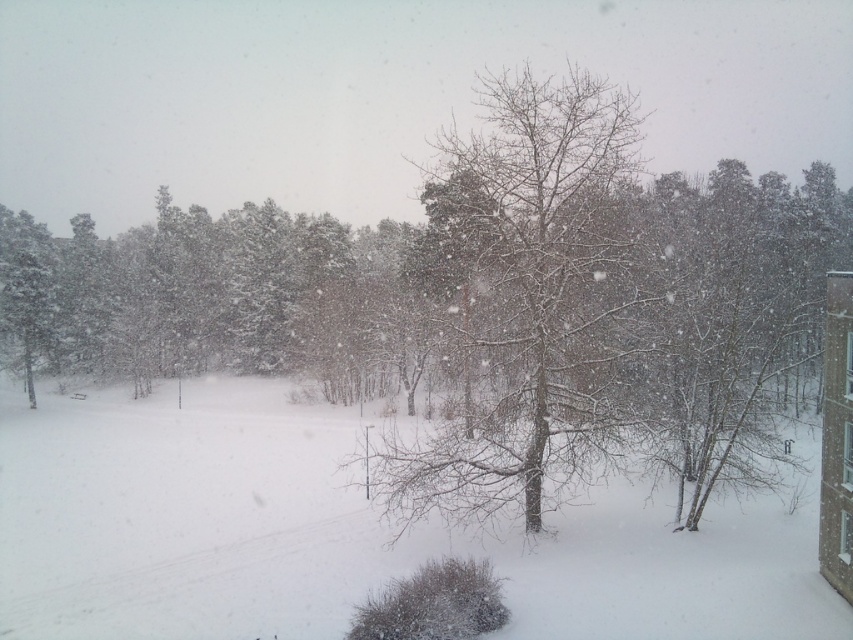
Question: Can you confirm if white fluffy snow at center is thinner than transparent glass window at right?

Choices:
 (A) yes
 (B) no

Answer: (B)

Question: Does white fluffy snow at center have a larger size compared to transparent glass window at right?

Choices:
 (A) no
 (B) yes

Answer: (B)

Question: Which point is farther to the camera?

Choices:
 (A) (848, 332)
 (B) (317, 568)
 (C) (595, 296)
 (D) (846, 554)

Answer: (B)

Question: Which point is closer to the camera?

Choices:
 (A) snow-covered bare tree at center
 (B) clear glass window at upper right
 (C) transparent glass window at upper right

Answer: (B)

Question: Is transparent glass window at upper right to the right of clear glass window at upper right from the viewer's perspective?

Choices:
 (A) no
 (B) yes

Answer: (B)

Question: Estimate the real-world distances between objects in this image. Which object is farther from the transparent glass window at upper right?

Choices:
 (A) white fluffy snow at center
 (B) transparent glass window at right
 (C) clear glass window at upper right
 (D) snow-covered bare tree at center

Answer: (D)